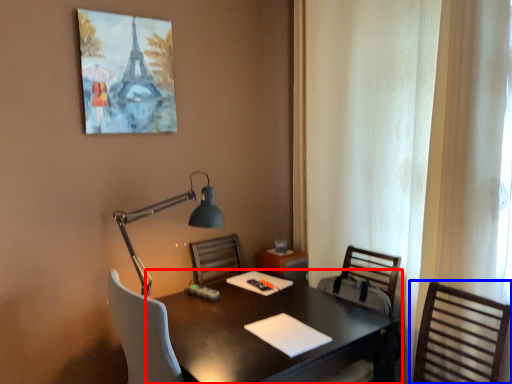
Question: Which object is further to the camera taking this photo, desk (highlighted by a red box) or chair (highlighted by a blue box)?

Choices:
 (A) desk
 (B) chair

Answer: (A)